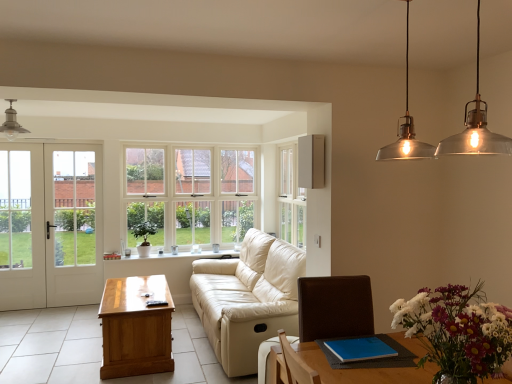
Find the location of a particular element. free space in front of white wooden door at left is located at coordinates (35, 329).